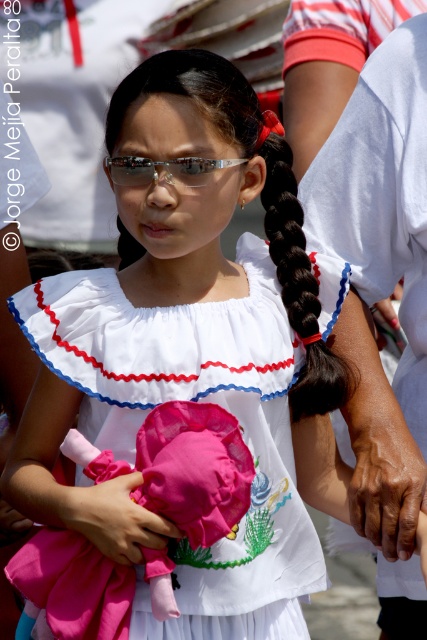
Question: Can you confirm if dry skin at lower right is smaller than shiny metallic sunglasses at center?

Choices:
 (A) no
 (B) yes

Answer: (A)

Question: Is dry skin at lower right smaller than shiny metallic sunglasses at center?

Choices:
 (A) yes
 (B) no

Answer: (B)

Question: Which of these objects is positioned farthest from the pink fabric doll at lower center?

Choices:
 (A) black silky hair at center
 (B) dry skin at lower right
 (C) shiny metallic sunglasses at center
 (D) white cotton dress at center

Answer: (C)

Question: In this image, where is white cotton dress at center located relative to dry skin at lower right?

Choices:
 (A) below
 (B) above

Answer: (B)

Question: Which object is farther from the camera taking this photo?

Choices:
 (A) pink fabric doll at lower center
 (B) black silky hair at center
 (C) white cotton dress at center

Answer: (B)

Question: Which point is farther to the camera?

Choices:
 (A) shiny metallic sunglasses at center
 (B) white cotton dress at center
 (C) pink fabric doll at lower center

Answer: (A)